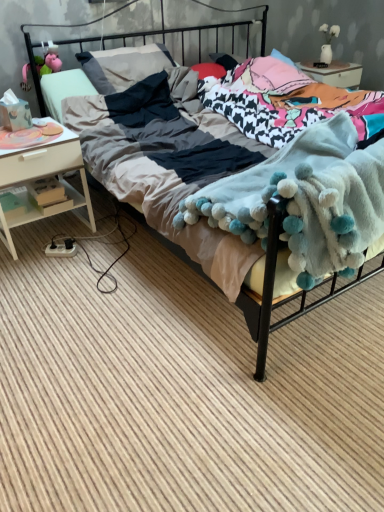
In order to face wooden boxes at left, should I rotate leftwards or rightwards?

Turn left by 18.800 degrees to look at wooden boxes at left.

Identify the location of soft cotton bed at center. (273, 286).

Which object is closer to the camera taking this photo, white wood nightstand at left or wooden boxes at left?

Positioned in front is white wood nightstand at left.

Is white wood nightstand at left far from wooden boxes at left?

white wood nightstand at left is actually quite close to wooden boxes at left.

From the image's perspective, between white wood nightstand at left and wooden boxes at left, who is located below?

wooden boxes at left appears lower in the image.

Measure the distance from white wood nightstand at left to wooden boxes at left.

white wood nightstand at left is 3.57 inches away from wooden boxes at left.

Who is taller, soft cotton bed at center or wooden boxes at left?

Standing taller between the two is soft cotton bed at center.

Considering the sizes of soft cotton bed at center and wooden boxes at left in the image, is soft cotton bed at center bigger or smaller than wooden boxes at left?

Considering their sizes, soft cotton bed at center takes up more space than wooden boxes at left.

Which object is thinner, soft cotton bed at center or wooden boxes at left?

wooden boxes at left is thinner.

I want to click on shelf directly beneath the soft cotton bed at center (from a real-world perspective), so click(55, 206).

Is the position of fluffy white blanket at center less distant than that of white wood nightstand at left?

Yes, it is.

From a real-world perspective, between fluffy white blanket at center and white wood nightstand at left, who is vertically lower?

From a 3D spatial view, white wood nightstand at left is below.

Considering the relative sizes of fluffy white blanket at center and white wood nightstand at left in the image provided, is fluffy white blanket at center bigger than white wood nightstand at left?

Indeed, fluffy white blanket at center has a larger size compared to white wood nightstand at left.

How distant is fluffy white blanket at center from white wood nightstand at left?

fluffy white blanket at center and white wood nightstand at left are 1.09 meters apart from each other.

Is wooden boxes at left completely or partially inside fluffy white blanket at center?

No, wooden boxes at left is located outside of fluffy white blanket at center.

Considering the points (317, 141) and (25, 195), which point is in front, point (317, 141) or point (25, 195)?

The point (317, 141) is more forward.

Which object is closer to the camera, fluffy white blanket at center or wooden boxes at left?

fluffy white blanket at center is closer to the camera.

Consider the image. From the image's perspective, which is below, fluffy white blanket at center or wooden boxes at left?

fluffy white blanket at center is shown below in the image.

Which object is positioned more to the left, wooden boxes at left or soft cotton bed at center?

From the viewer's perspective, wooden boxes at left appears more on the left side.

From the image's perspective, is wooden boxes at left located above or below soft cotton bed at center?

wooden boxes at left is situated lower than soft cotton bed at center in the image.

Does point (68, 184) appear closer or farther from the camera than point (338, 293)?

Point (68, 184) is farther from the camera than point (338, 293).

Which of these two, wooden boxes at left or soft cotton bed at center, is wider?

Wider between the two is soft cotton bed at center.

Is fluffy white blanket at center positioned with its back to soft cotton bed at center?

Yes, fluffy white blanket at center is facing away from soft cotton bed at center.

Based on the photo, which of these two, fluffy white blanket at center or soft cotton bed at center, stands taller?

soft cotton bed at center.

Is soft cotton bed at center completely or partially inside fluffy white blanket at center?

Actually, soft cotton bed at center is outside fluffy white blanket at center.

From the image's perspective, is wooden boxes at left located beneath fluffy white blanket at center?

No.

Considering the points (39, 215) and (291, 261), which point is behind, point (39, 215) or point (291, 261)?

Positioned behind is point (39, 215).

Can you see wooden boxes at left touching fluffy white blanket at center?

No, wooden boxes at left is not touching fluffy white blanket at center.

Locate an element on the screen. shelf that is behind the white wood nightstand at left is located at coordinates [x=55, y=206].

Locate an element on the screen. The width and height of the screenshot is (384, 512). bed above the wooden boxes at left (from a real-world perspective) is located at coordinates pyautogui.click(x=273, y=286).

Based on their spatial positions, is fluffy white blanket at center or wooden boxes at left further from soft cotton bed at center?

fluffy white blanket at center.

Estimate the real-world distances between objects in this image. Which object is closer to fluffy white blanket at center, soft cotton bed at center or white wood nightstand at left?

Among the two, white wood nightstand at left is located nearer to fluffy white blanket at center.

Considering their positions, is soft cotton bed at center positioned closer to wooden boxes at left than fluffy white blanket at center?

The object closer to wooden boxes at left is soft cotton bed at center.

Looking at the image, which one is located closer to wooden boxes at left, white wood nightstand at left or soft cotton bed at center?

white wood nightstand at left.

Considering their positions, is fluffy white blanket at center positioned closer to white wood nightstand at left than soft cotton bed at center?

soft cotton bed at center is closer to white wood nightstand at left.

Considering their positions, is soft cotton bed at center positioned closer to fluffy white blanket at center than wooden boxes at left?

The object closer to fluffy white blanket at center is wooden boxes at left.

Estimate the real-world distances between objects in this image. Which object is closer to soft cotton bed at center, wooden boxes at left or white wood nightstand at left?

white wood nightstand at left lies closer to soft cotton bed at center than the other object.

From the image, which object appears to be nearer to wooden boxes at left, fluffy white blanket at center or white wood nightstand at left?

The object closer to wooden boxes at left is white wood nightstand at left.

At what (x,y) coordinates should I click in order to perform the action: click on shelf between white wood nightstand at left and soft cotton bed at center in the horizontal direction. Please return your answer as a coordinate pair (x, y). Looking at the image, I should click on (55, 206).

This screenshot has height=512, width=384. I want to click on bed located between white wood nightstand at left and fluffy white blanket at center in the left-right direction, so click(x=273, y=286).

You are a GUI agent. You are given a task and a screenshot of the screen. Output one action in this format:
    pyautogui.click(x=<x>, y=<y>)
    Task: Click on the shelf situated between white wood nightstand at left and fluffy white blanket at center from left to right
    The image size is (384, 512).
    Given the screenshot: What is the action you would take?
    pyautogui.click(x=55, y=206)

At what (x,y) coordinates should I click in order to perform the action: click on bed between wooden boxes at left and fluffy white blanket at center from left to right. Please return your answer as a coordinate pair (x, y). This screenshot has width=384, height=512. Looking at the image, I should click on (273, 286).